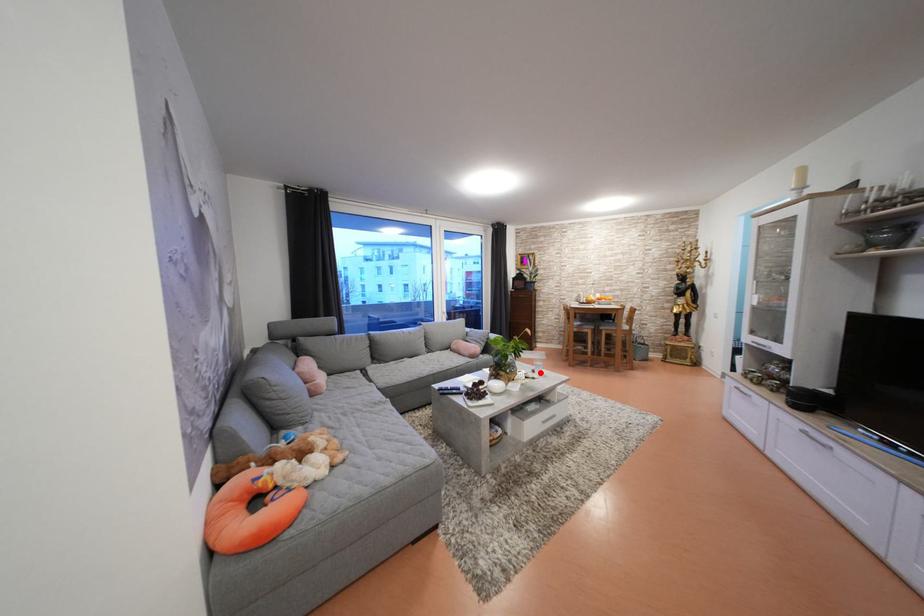
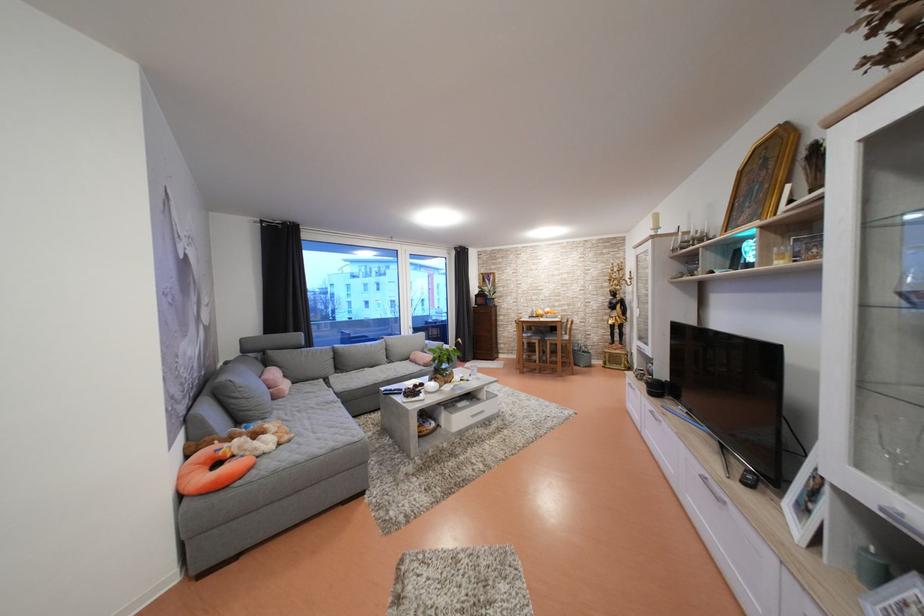
Find the pixel in the second image that matches the highlighted location in the first image.

(476, 377)